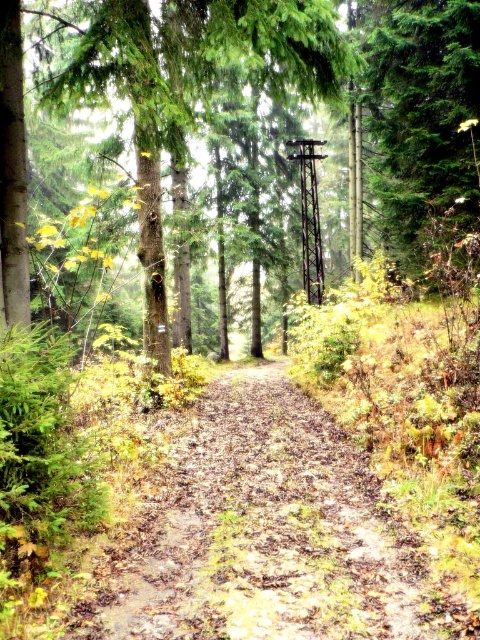
Is brown dirt path at center below green matte tree at center?

Correct, brown dirt path at center is located below green matte tree at center.

In the scene shown: Which is more to the left, brown dirt path at center or green matte tree at center?

From the viewer's perspective, brown dirt path at center appears more on the left side.

Is point (240, 588) less distant than point (4, 253)?

Yes, it is.

Locate an element on the screen. brown dirt path at center is located at coordinates (259, 532).